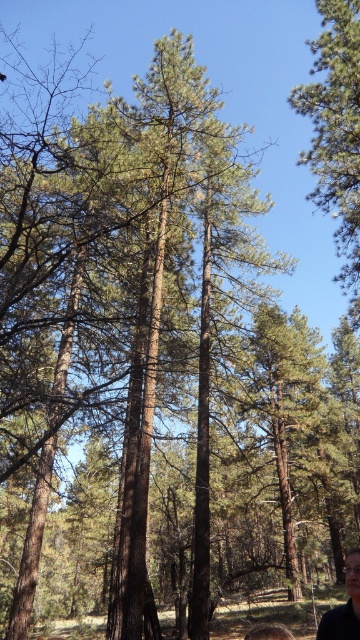
Question: Can you confirm if green needle-like at upper center is wider than blonde hair at lower right?

Choices:
 (A) no
 (B) yes

Answer: (B)

Question: Can you confirm if green needle-like at upper center is positioned below dark brown hair at lower right?

Choices:
 (A) yes
 (B) no

Answer: (B)

Question: Based on their relative distances, which object is nearer to the blonde hair at lower right?

Choices:
 (A) dark brown hair at lower right
 (B) green needle-like at upper center

Answer: (A)

Question: Does dark brown hair at lower right have a greater width compared to blonde hair at lower right?

Choices:
 (A) no
 (B) yes

Answer: (A)

Question: Which object is farther from the camera taking this photo?

Choices:
 (A) green needle-like at upper center
 (B) blonde hair at lower right

Answer: (A)

Question: Which object is farther from the camera taking this photo?

Choices:
 (A) blonde hair at lower right
 (B) green needle-like at upper center
 (C) dark brown hair at lower right

Answer: (B)